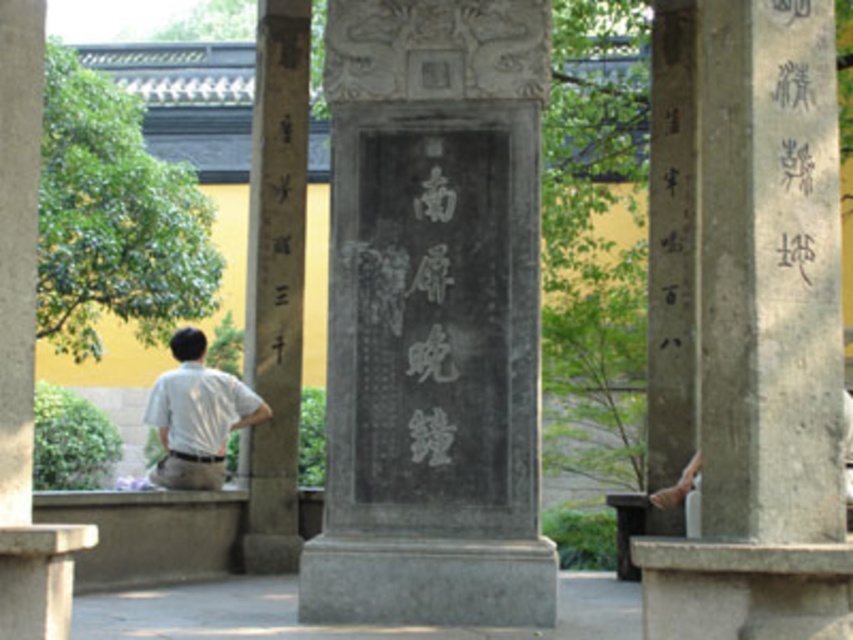
Question: Which point appears closest to the camera in this image?

Choices:
 (A) (292, 250)
 (B) (837, 365)
 (C) (230, 406)
 (D) (421, 179)

Answer: (B)

Question: Which point is closer to the camera taking this photo?

Choices:
 (A) (257, 364)
 (B) (368, 90)
 (C) (648, 592)
 (D) (192, 461)

Answer: (C)

Question: Can you confirm if gray stone pillar at right is positioned below black stone pillar at left?

Choices:
 (A) no
 (B) yes

Answer: (B)

Question: Does gray stone pillar at right lie behind black stone pillar at left?

Choices:
 (A) no
 (B) yes

Answer: (A)

Question: Can you confirm if black stone plaque at center is positioned below white shirt at left?

Choices:
 (A) no
 (B) yes

Answer: (A)

Question: Which of the following is the closest to the observer?

Choices:
 (A) white shirt at left
 (B) black stone pillar at left

Answer: (A)